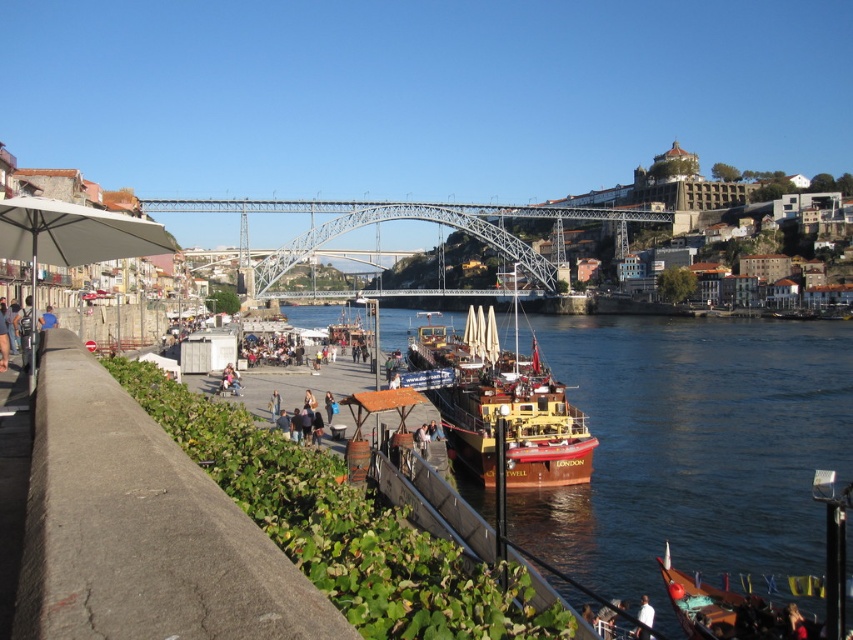
Question: Which object is closer to the camera taking this photo?

Choices:
 (A) wooden polished boat at center
 (B) white fabric umbrella at left

Answer: (B)

Question: In this image, where is brown wooden boat at center located relative to white fabric shirt at lower right?

Choices:
 (A) left
 (B) right

Answer: (B)

Question: Does brown wooden boat at center appear under light brown leather jacket at center?

Choices:
 (A) no
 (B) yes

Answer: (A)

Question: Which object appears farthest from the camera in this image?

Choices:
 (A) wooden polished boat at center
 (B) brown wooden boat at center
 (C) metallic steel bridge at center

Answer: (C)

Question: Is wooden polished boat at center to the right of white fabric shirt at lower right from the viewer's perspective?

Choices:
 (A) yes
 (B) no

Answer: (B)

Question: Estimate the real-world distances between objects in this image. Which object is farther from the light brown leather jacket at center?

Choices:
 (A) white fabric shirt at lower right
 (B) white fabric umbrella at left

Answer: (A)